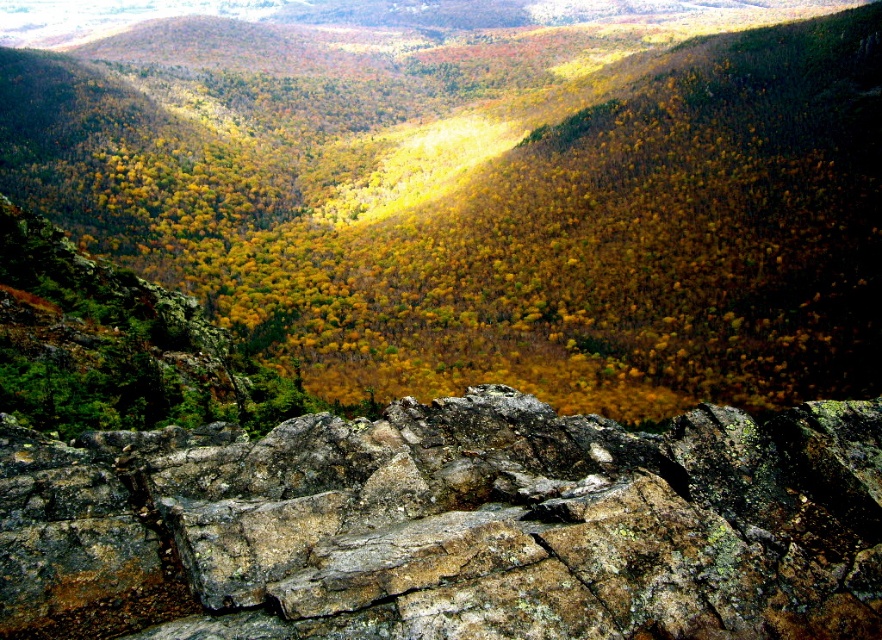
Can you confirm if rocky terrain at lower center is positioned below rusty rock at bottom?

No, rocky terrain at lower center is not below rusty rock at bottom.

Looking at this image, between rocky terrain at lower center and rusty rock at bottom, which one appears on the left side from the viewer's perspective?

Positioned to the left is rusty rock at bottom.

Find the location of `rocky terrain at lower center`. rocky terrain at lower center is located at coordinates click(x=487, y=189).